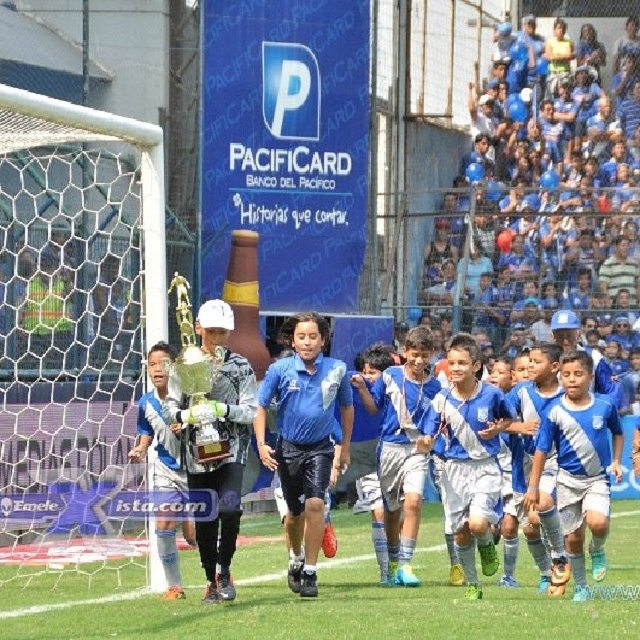
Is white mesh net at left above blue jersey shorts at center?

Answer: Yes, white mesh net at left is above blue jersey shorts at center.

Does white mesh net at left have a greater height compared to blue jersey shorts at center?

Indeed, white mesh net at left has a greater height compared to blue jersey shorts at center.

Is point (138, 556) closer to viewer compared to point (385, 525)?

No, it is behind (385, 525).

Where is `white mesh net at left`? Image resolution: width=640 pixels, height=640 pixels. white mesh net at left is located at coordinates (76, 337).

Does blue jersey at center appear over blue matte soccer uniform at center?

No.

Does point (547, 433) come behind point (468, 504)?

No, (547, 433) is closer to viewer.

Where is `blue jersey at center`? blue jersey at center is located at coordinates (579, 465).

Is white mesh net at left smaller than blue matte soccer uniform at center?

Actually, white mesh net at left might be larger than blue matte soccer uniform at center.

Who is shorter, white mesh net at left or blue matte soccer uniform at center?

blue matte soccer uniform at center

Is point (68, 440) less distant than point (472, 420)?

No, it is behind (472, 420).

This screenshot has width=640, height=640. I want to click on white mesh net at left, so click(x=76, y=337).